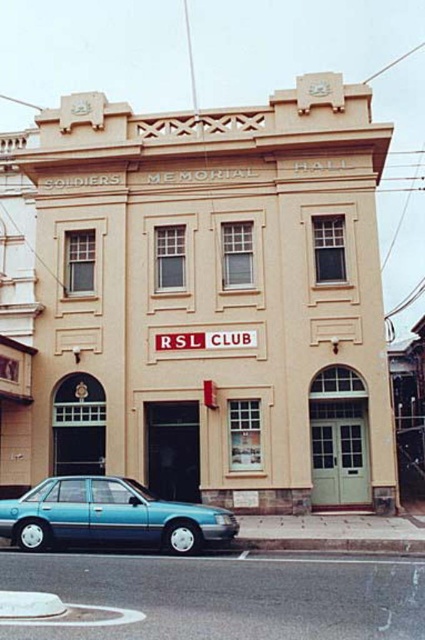
Which of these two, beige stone building at center or black asphalt road at lower center, stands taller?

beige stone building at center

Can you confirm if beige stone building at center is smaller than black asphalt road at lower center?

Actually, beige stone building at center might be larger than black asphalt road at lower center.

Between point (17, 218) and point (166, 576), which one is positioned in front?

Point (166, 576) is more forward.

You are a GUI agent. You are given a task and a screenshot of the screen. Output one action in this format:
    pyautogui.click(x=<x>, y=<y>)
    Task: Click on the beige stone building at center
    
    Given the screenshot: What is the action you would take?
    pyautogui.click(x=201, y=300)

Which is behind, point (155, 577) or point (223, 520)?

Positioned behind is point (223, 520).

Locate an element on the screen. The width and height of the screenshot is (425, 640). black asphalt road at lower center is located at coordinates (229, 595).

Can you confirm if beige stone building at center is taller than teal glossy sedan at lower left?

Indeed, beige stone building at center has a greater height compared to teal glossy sedan at lower left.

Is beige stone building at center above teal glossy sedan at lower left?

Yes, beige stone building at center is above teal glossy sedan at lower left.

Between point (314, 412) and point (153, 531), which one is positioned behind?

The point (314, 412) is behind.

This screenshot has height=640, width=425. Find the location of `beige stone building at center`. beige stone building at center is located at coordinates (201, 300).